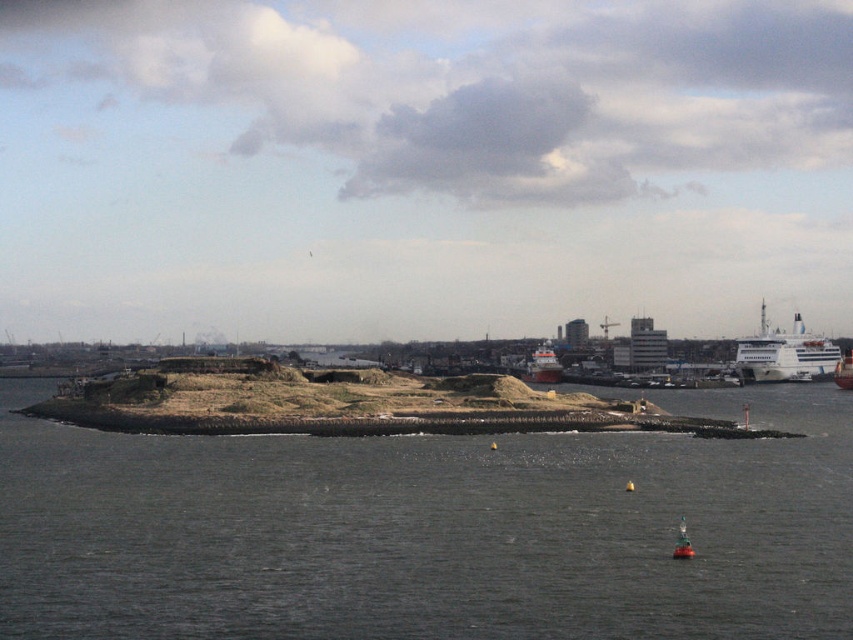
Question: Among these points, which one is nearest to the camera?

Choices:
 (A) (769, 358)
 (B) (679, 541)

Answer: (B)

Question: Is dark gray water at center below white glossy ship at right?

Choices:
 (A) no
 (B) yes

Answer: (B)

Question: Can you confirm if white glossy cruise ship at right is positioned above white glossy ship at right?

Choices:
 (A) no
 (B) yes

Answer: (B)

Question: Does white matte ship at center-right have a greater width compared to white glossy ship at right?

Choices:
 (A) no
 (B) yes

Answer: (A)

Question: Which point is farther to the camera?

Choices:
 (A) (850, 381)
 (B) (688, 536)
 (C) (680, 493)

Answer: (A)

Question: Estimate the real-world distances between objects in this image. Which object is closer to the dark gray water at center?

Choices:
 (A) white matte ship at center-right
 (B) white glossy ship at right
 (C) metallic red buoy at lower right

Answer: (C)